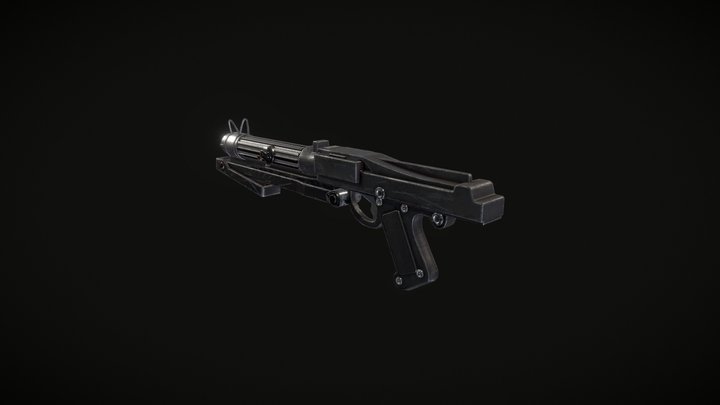
Find the location of `handle`. handle is located at coordinates coord(427,249).